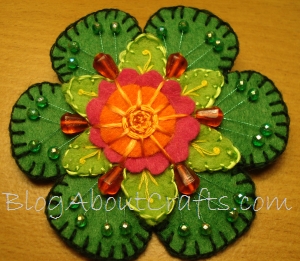
Locate an element on the screen. corners is located at coordinates (291, 253), (5, 252), (4, 5), (294, 4).